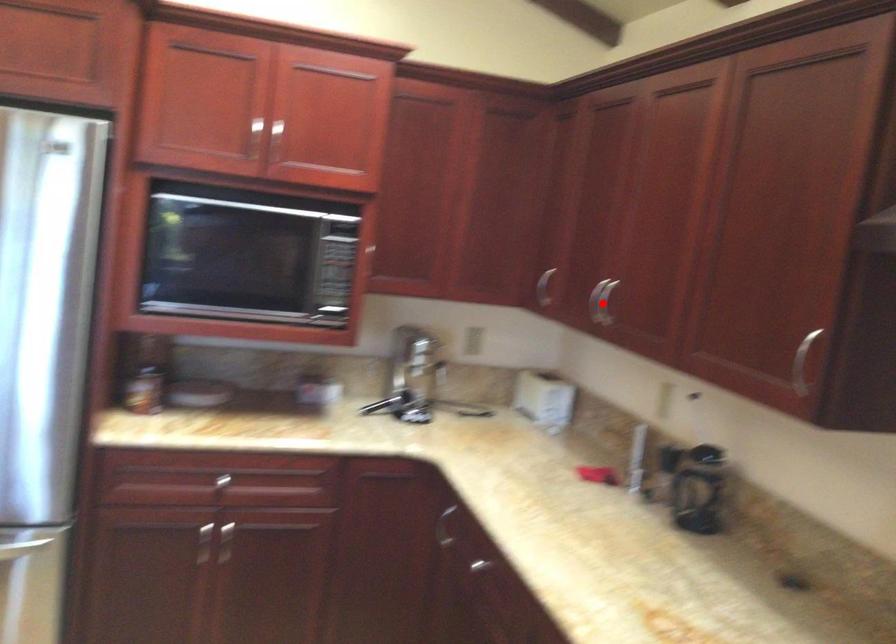
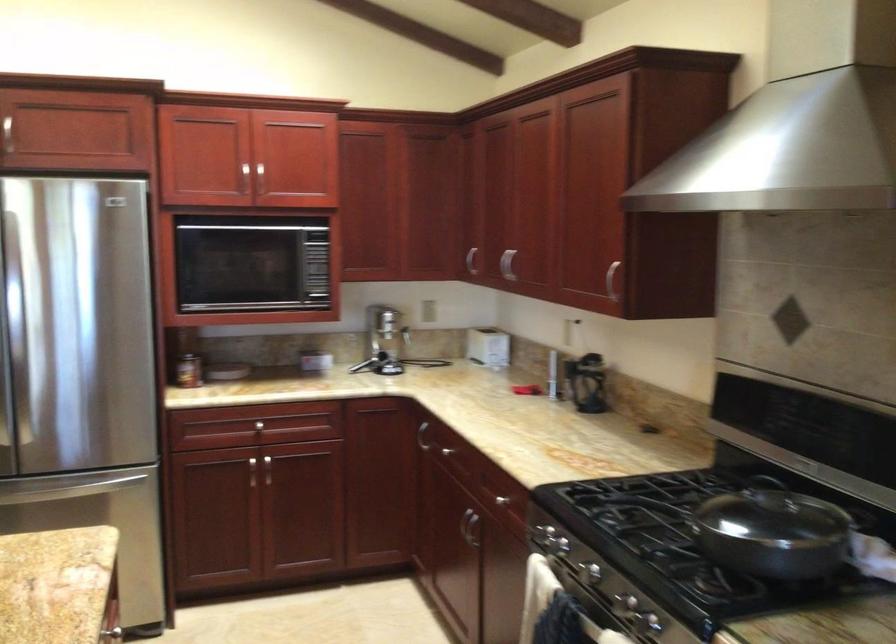
Question: I am providing you with two images of the same scene from different viewpoints. Image1 has a red point marked. In image2, the corresponding 3D location appears at what relative position? Reply with the corresponding letter.

Choices:
 (A) Closer
 (B) Farther

Answer: (B)